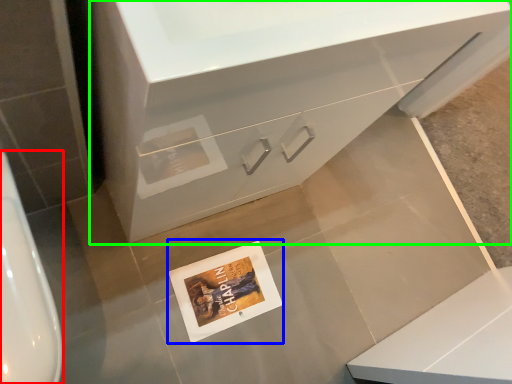
Question: Considering the real-world distances, which object is farthest from urinal (highlighted by a red box)? postcard (highlighted by a blue box) or bathroom cabinet (highlighted by a green box)?

Choices:
 (A) postcard
 (B) bathroom cabinet

Answer: (A)